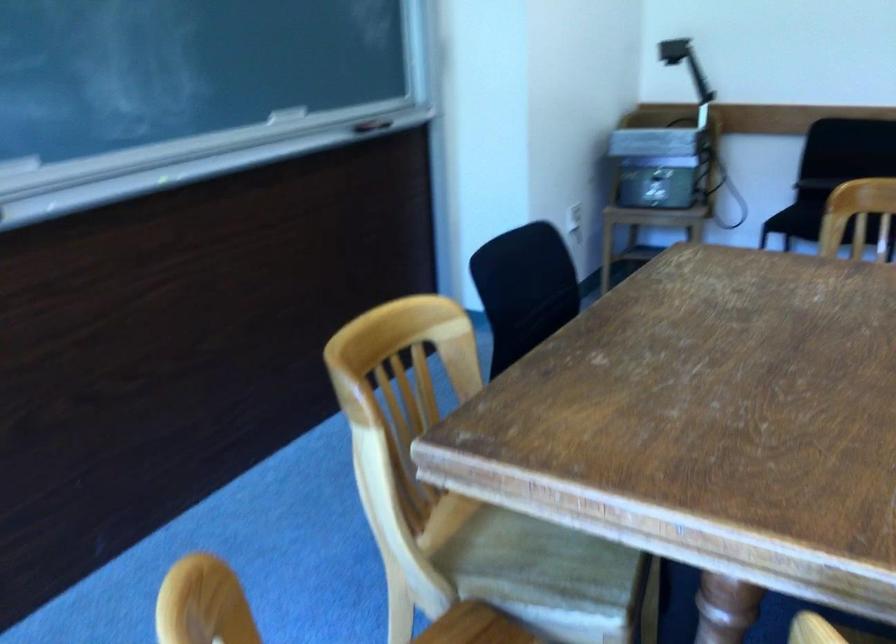
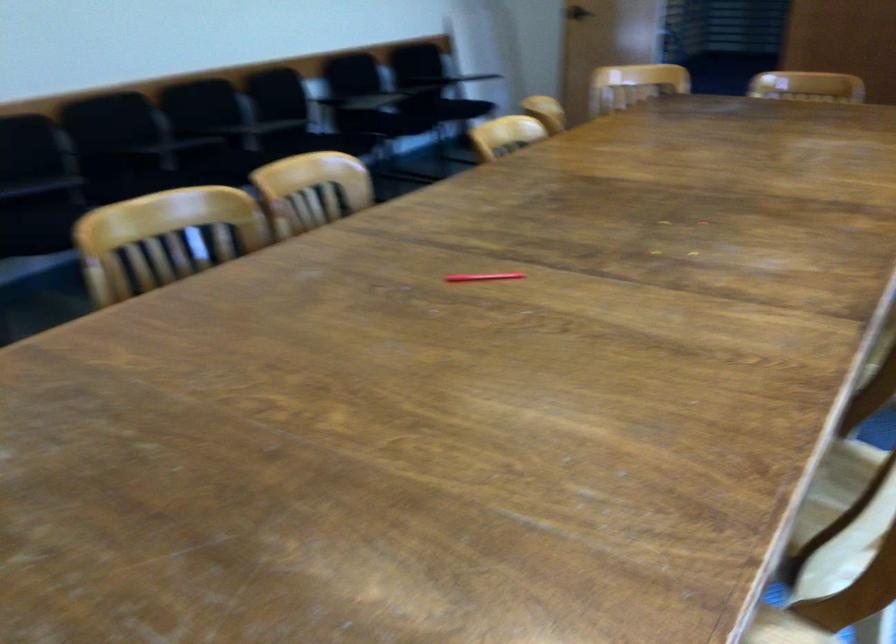
The first image is from the beginning of the video and the second image is from the end. How did the camera likely rotate when shooting the video?

The rotation direction of the camera is right-down.